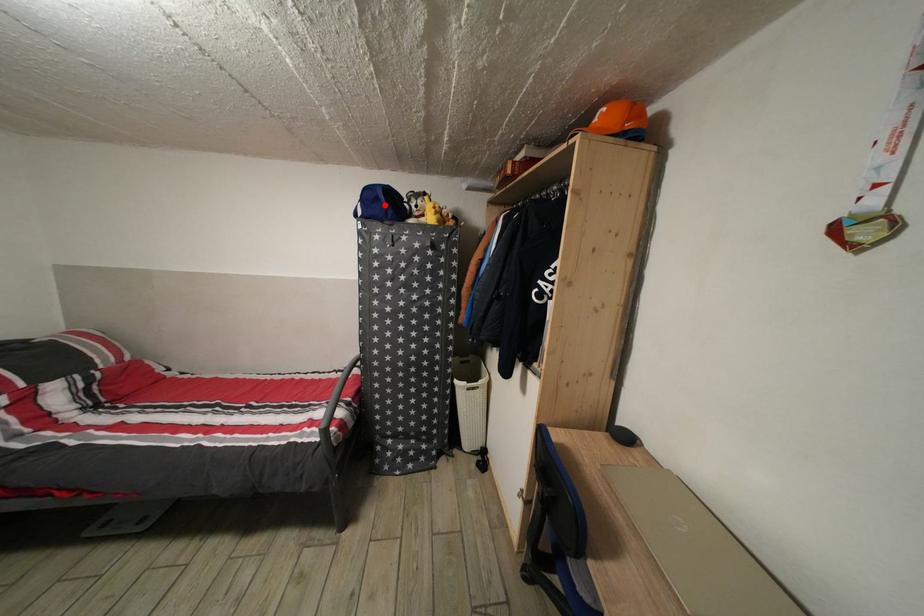
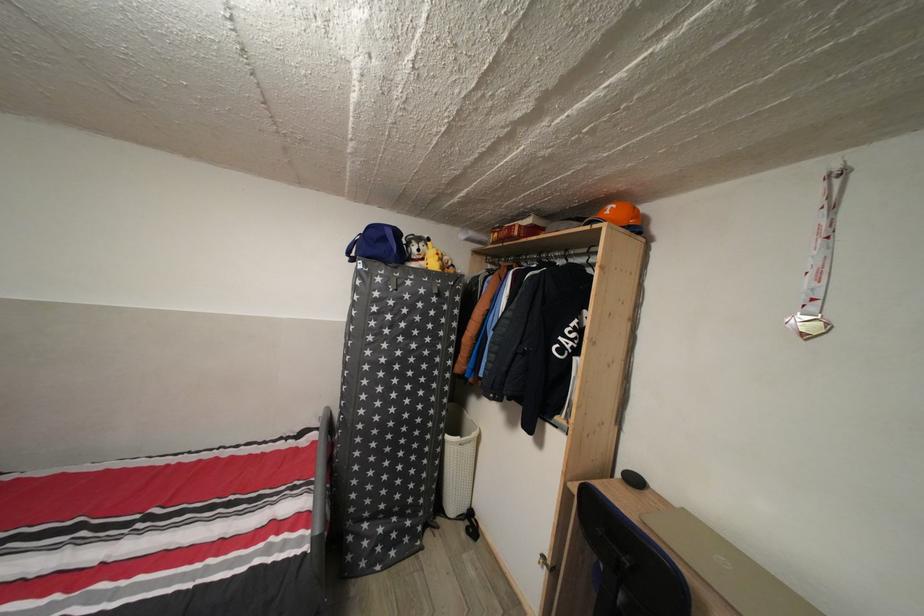
In the second image, find the point that corresponds to the highlighted location in the first image.

(391, 246)